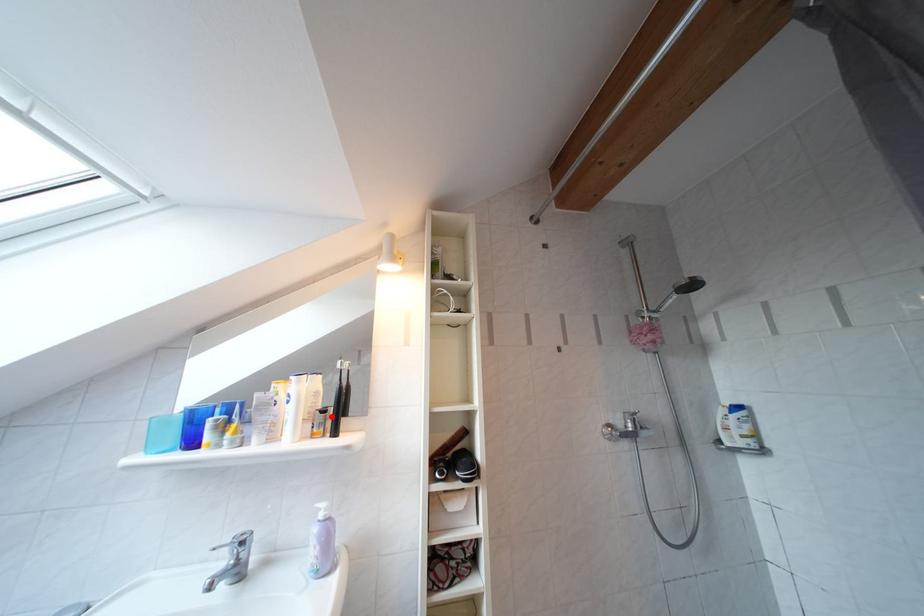
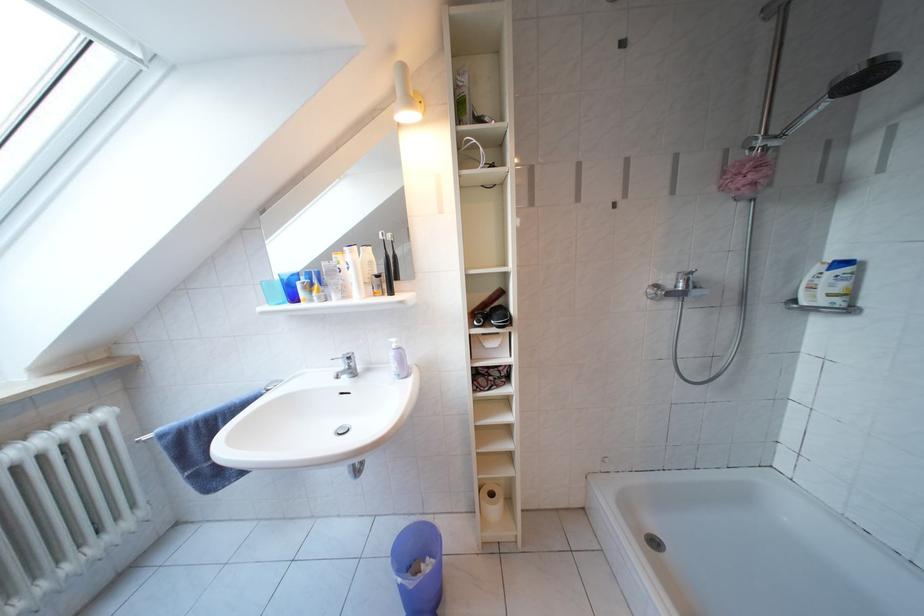
Where in the second image is the point corresponding to the highlighted location from the first image?

(386, 281)